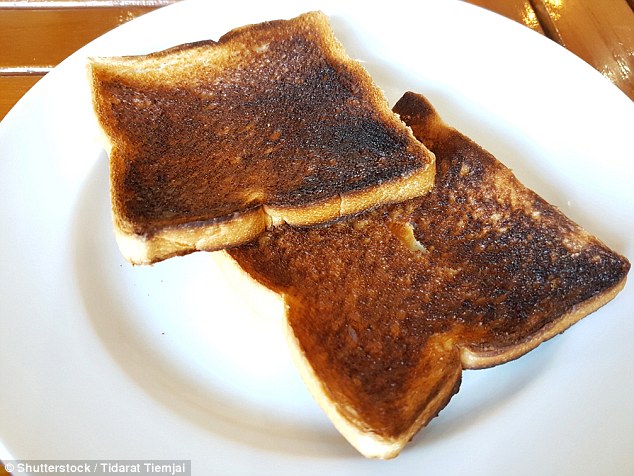
Where is `white plate`? The width and height of the screenshot is (634, 476). white plate is located at coordinates (120, 415), (37, 193), (540, 61), (533, 405).